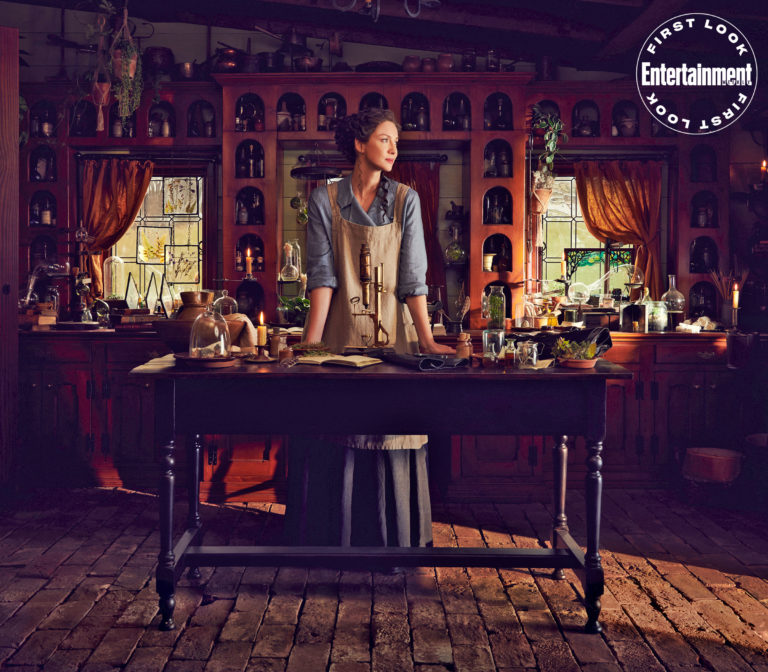
Where is `cabinet doors`? The width and height of the screenshot is (768, 672). cabinet doors is located at coordinates (68, 421), (128, 425), (247, 462), (621, 425), (677, 420), (504, 466).